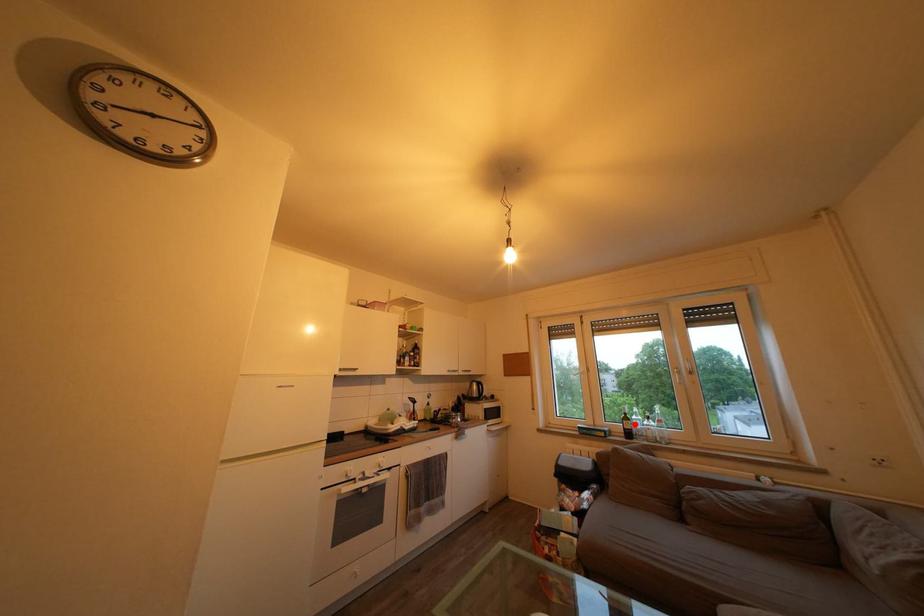
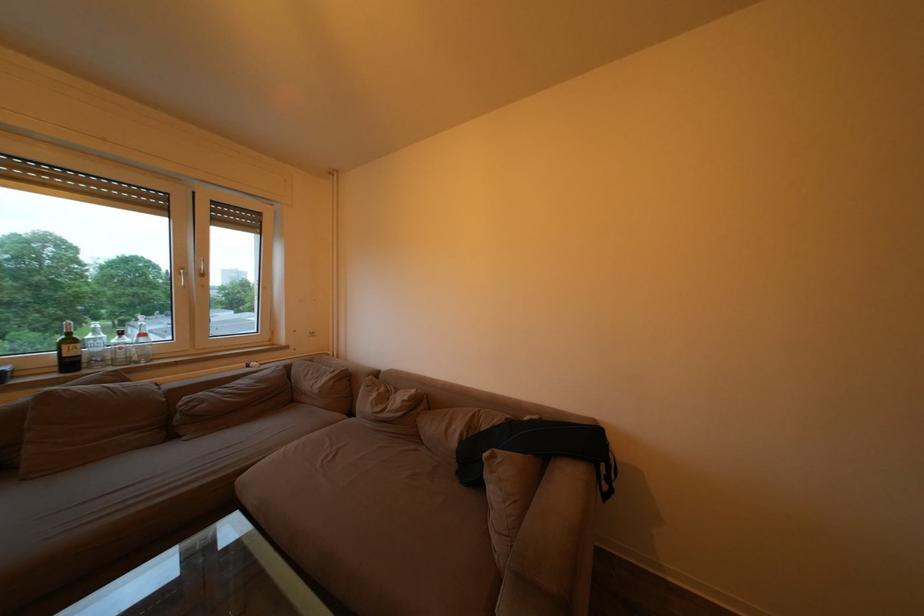
Where in the second image is the point corresponding to the highlighted location from the first image?

(79, 347)